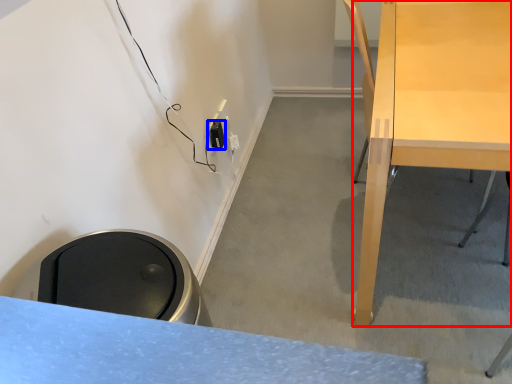
Question: Which of the following is the closest to the observer, desk (highlighted by a red box) or electric outlet (highlighted by a blue box)?

Choices:
 (A) desk
 (B) electric outlet

Answer: (A)